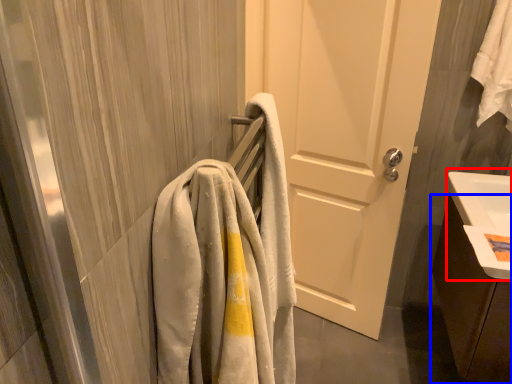
Question: Which point is closer to the camera, sink (highlighted by a red box) or bathroom cabinet (highlighted by a blue box)?

Choices:
 (A) sink
 (B) bathroom cabinet

Answer: (A)